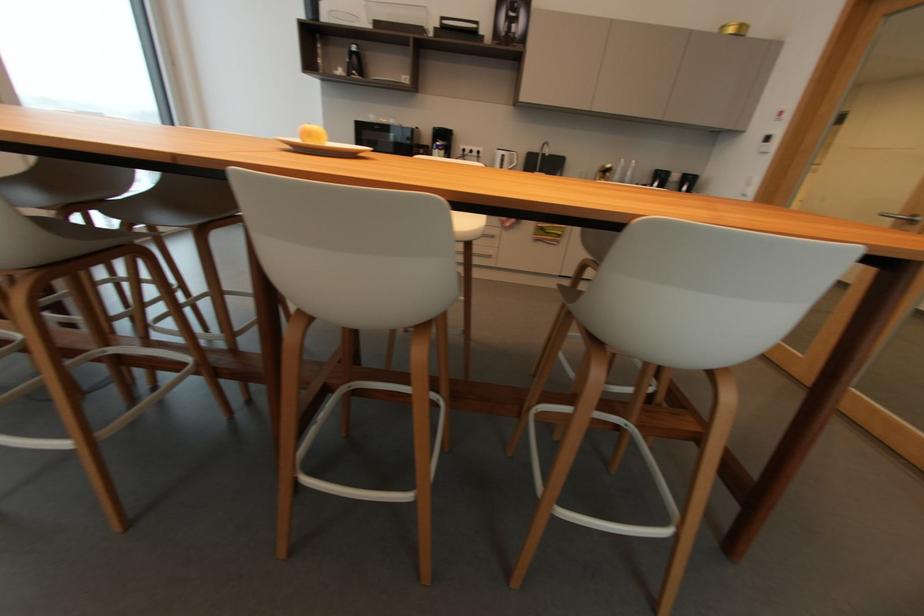
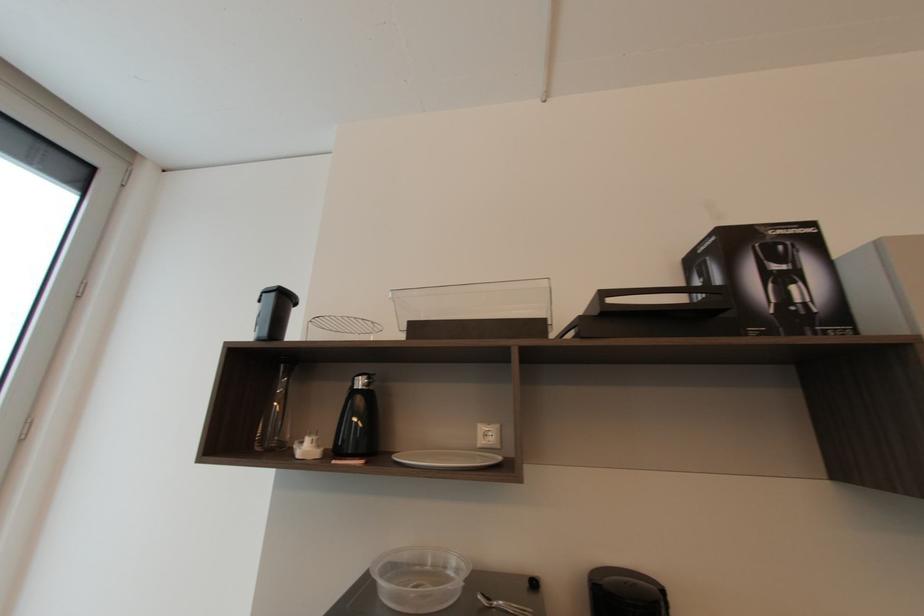
Where in the second image is the point corresponding to point 358,49 from the first image?

(362, 384)